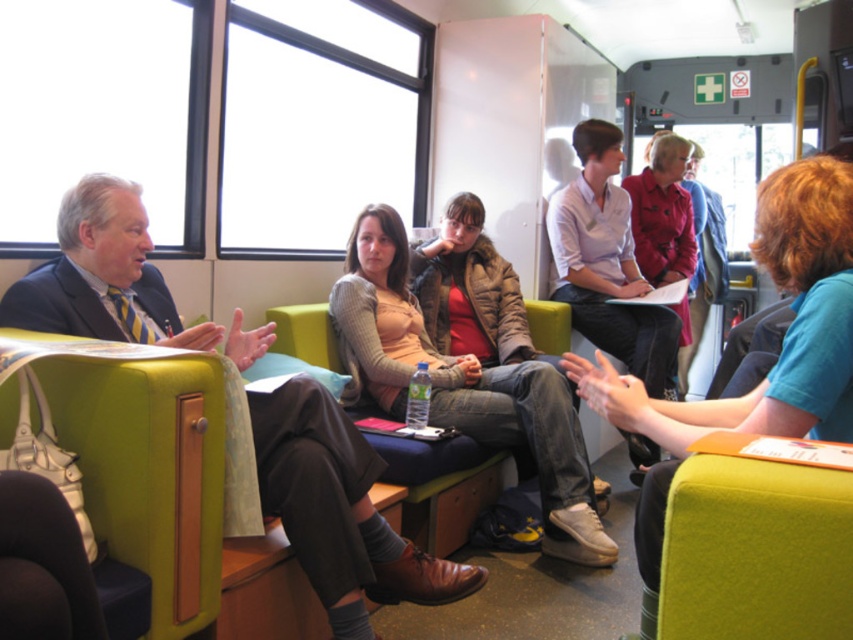
Question: Which point is farther to the camera?

Choices:
 (A) (659, 579)
 (B) (314, 509)
 (C) (670, 163)
 (D) (389, 320)

Answer: (C)

Question: Is matte green coach at left to the left of blue cotton shirt at center from the viewer's perspective?

Choices:
 (A) no
 (B) yes

Answer: (B)

Question: Which of the following is the farthest from the observer?

Choices:
 (A) (747, 502)
 (B) (756, 396)
 (C) (233, 499)

Answer: (C)

Question: Considering the relative positions of matte beige sweater at center and matte red coat at center in the image provided, where is matte beige sweater at center located with respect to matte red coat at center?

Choices:
 (A) below
 (B) above

Answer: (A)

Question: Among these objects, which one is farthest from the camera?

Choices:
 (A) matte green coach at left
 (B) blue cotton shirt at center

Answer: (A)

Question: Does blue cotton shirt at center appear over green felt chair at lower right?

Choices:
 (A) yes
 (B) no

Answer: (A)